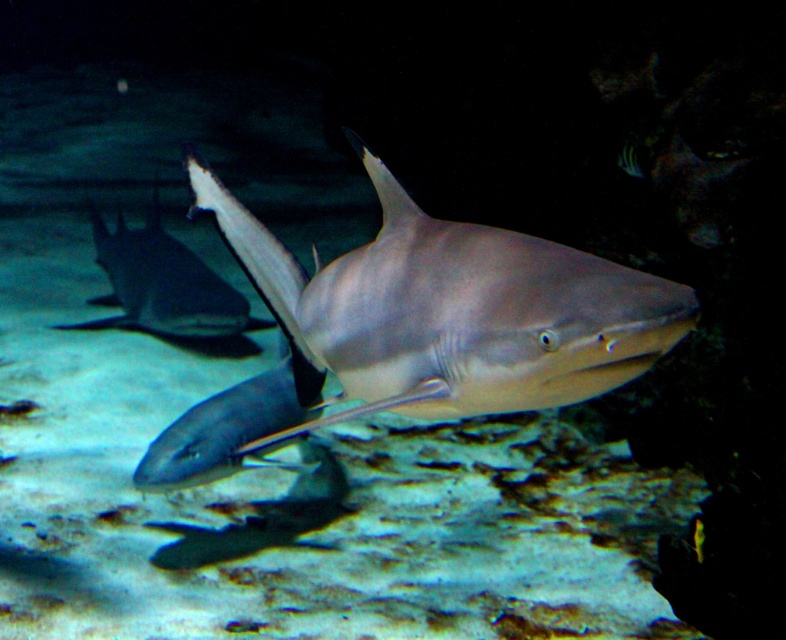
Between smooth gray shark at center and smooth gray stingray at center, which one is positioned higher?

smooth gray stingray at center is higher up.

Is smooth gray shark at center in front of smooth gray stingray at center?

Yes.

Who is more distant from viewer, [430,221] or [174,282]?

Point [174,282]

Identify the location of smooth gray shark at center. The height and width of the screenshot is (640, 786). (417, 326).